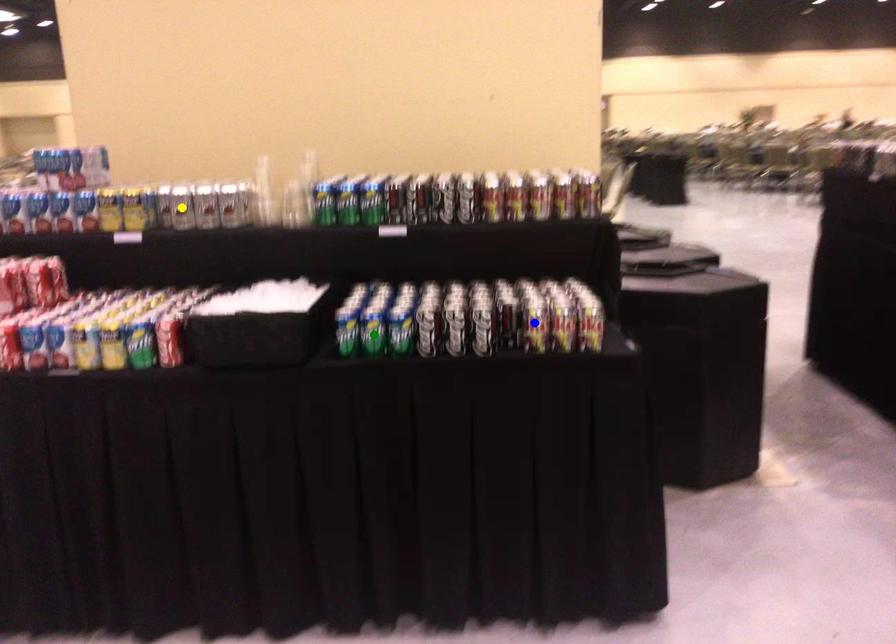
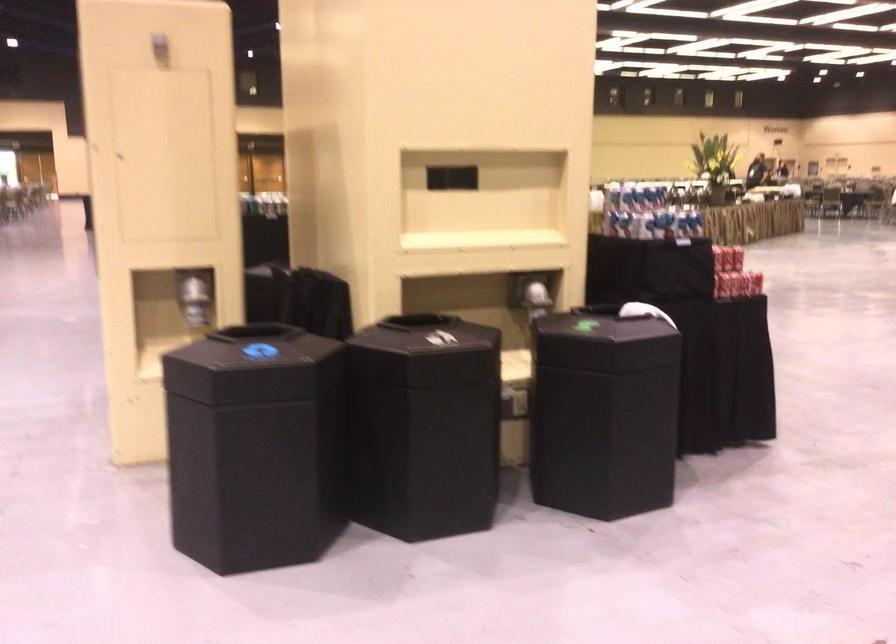
I am providing you with two images of the same scene from different viewpoints. Three points are marked in image1. Which point corresponds to a part or object that is occluded in image2?In image1, three points are marked. Which of them correspond to a part or object that is occluded in image2?Among the three points shown in image1, which one corresponds to a part or object that is no longer visible due to occlusion in image2?

yellow point, blue point, green point cannot be seen in image2.